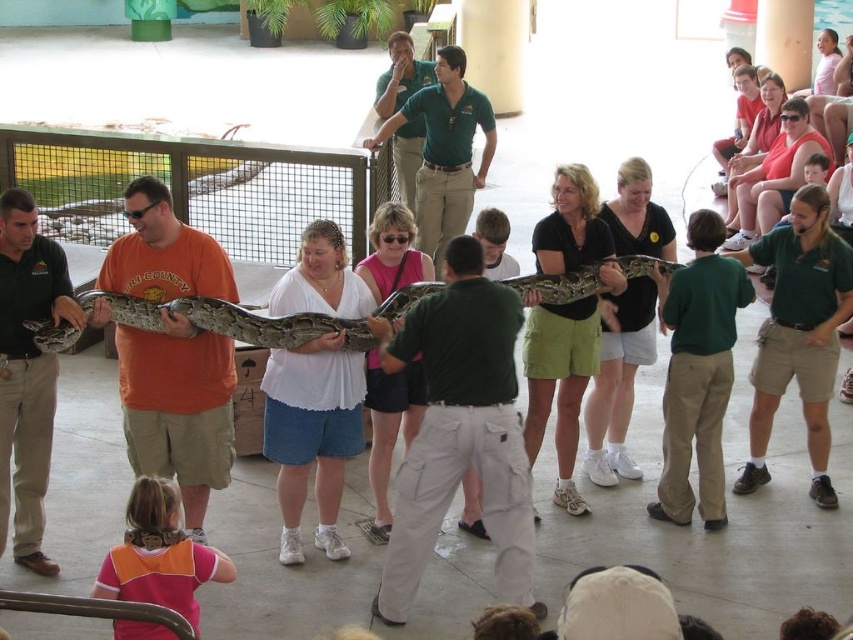
You are a photographer standing in front of the reptile exhibit. You need to take a photo of the orange cotton shirt at center and the matte green shirt at center so that both are fully visible. Given their height difference, which person should you position closer to the camera to ensure both are visible?

Since the orange cotton shirt at center is much taller than the matte green shirt at center, you should position the shorter matte green shirt at center closer to the camera to ensure both are fully visible in the photo.

You are standing at the front of the reptile exhibit and want to move from point A to point B. The points are labeled as point A at coordinate point [10,291] and point B at coordinate point [221,314]. Considering the snake is stretched across the group of people, which point would you need to walk around the snake to reach?

Point A at coordinate point [10,291] is in front of point B at coordinate point [221,314]. Therefore, to reach point B, you would need to walk around the snake since it is blocking the direct path to point B.